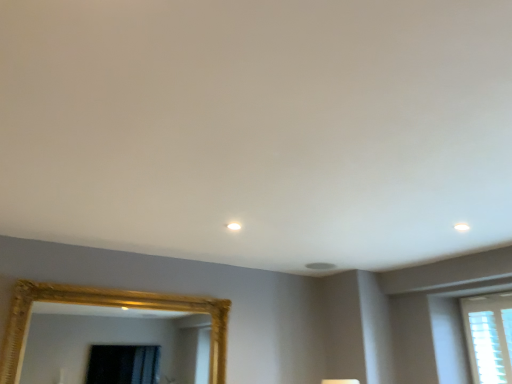
Locate an element on the screen. gold textured mirror at lower left is located at coordinates (113, 341).

What do you see at coordinates (113, 341) in the screenshot?
I see `gold textured mirror at lower left` at bounding box center [113, 341].

Identify the location of white textured blinds at right. This screenshot has height=384, width=512. (487, 348).

Describe the element at coordinates (487, 348) in the screenshot. I see `white textured blinds at right` at that location.

In order to click on gold textured mirror at lower left in this screenshot , I will do `click(113, 341)`.

Considering the relative positions of gold textured mirror at lower left and white textured blinds at right in the image provided, is gold textured mirror at lower left to the right of white textured blinds at right from the viewer's perspective?

No, gold textured mirror at lower left is not to the right of white textured blinds at right.

Based on the photo, is the position of gold textured mirror at lower left less distant than that of white textured blinds at right?

That is True.

Considering the positions of points (61, 336) and (493, 340), is point (61, 336) closer to camera compared to point (493, 340)?

That is False.

From the image's perspective, is gold textured mirror at lower left above or below white textured blinds at right?

Clearly, from the image's perspective, gold textured mirror at lower left is above white textured blinds at right.

From a real-world perspective, is gold textured mirror at lower left physically above white textured blinds at right?

No, from a real-world perspective, gold textured mirror at lower left is not over white textured blinds at right

Does gold textured mirror at lower left have a greater width compared to white textured blinds at right?

Yes, gold textured mirror at lower left is wider than white textured blinds at right.

Who is taller, gold textured mirror at lower left or white textured blinds at right?

Standing taller between the two is white textured blinds at right.

In terms of size, does gold textured mirror at lower left appear bigger or smaller than white textured blinds at right?

gold textured mirror at lower left is bigger than white textured blinds at right.

Choose the correct answer: Is gold textured mirror at lower left inside white textured blinds at right or outside it?

gold textured mirror at lower left exists outside the volume of white textured blinds at right.

Consider the image. Is gold textured mirror at lower left positioned far away from white textured blinds at right?

Yes, gold textured mirror at lower left and white textured blinds at right are quite far apart.

Is gold textured mirror at lower left aimed at white textured blinds at right?

No, gold textured mirror at lower left is not oriented towards white textured blinds at right.

Where is `mirror that appears below the white textured blinds at right (from a real-world perspective)`? mirror that appears below the white textured blinds at right (from a real-world perspective) is located at coordinates (113, 341).

Does white textured blinds at right appear on the right side of gold textured mirror at lower left?

Yes.

Who is more distant, white textured blinds at right or gold textured mirror at lower left?

white textured blinds at right.

Which is farther, (498,343) or (205,342)?

Positioned behind is point (205,342).

From the image's perspective, does white textured blinds at right appear lower than gold textured mirror at lower left?

Yes.

From a real-world perspective, between white textured blinds at right and gold textured mirror at lower left, who is vertically higher?

white textured blinds at right.

Is white textured blinds at right thinner than gold textured mirror at lower left?

Indeed, white textured blinds at right has a lesser width compared to gold textured mirror at lower left.

From their relative heights in the image, would you say white textured blinds at right is taller or shorter than gold textured mirror at lower left?

white textured blinds at right is taller than gold textured mirror at lower left.

Looking at the image, does white textured blinds at right seem bigger or smaller compared to gold textured mirror at lower left?

Considering their sizes, white textured blinds at right takes up less space than gold textured mirror at lower left.

Is gold textured mirror at lower left surrounded by white textured blinds at right?

No.

Is white textured blinds at right far away from gold textured mirror at lower left?

Yes.

Is white textured blinds at right oriented away from gold textured mirror at lower left?

No, white textured blinds at right is not facing away from gold textured mirror at lower left.

This screenshot has width=512, height=384. I want to click on window below the gold textured mirror at lower left (from the image's perspective), so pyautogui.click(x=487, y=348).

The image size is (512, 384). I want to click on mirror that appears in front of the white textured blinds at right, so click(x=113, y=341).

Find the location of a particular element. mirror above the white textured blinds at right (from the image's perspective) is located at coordinates (113, 341).